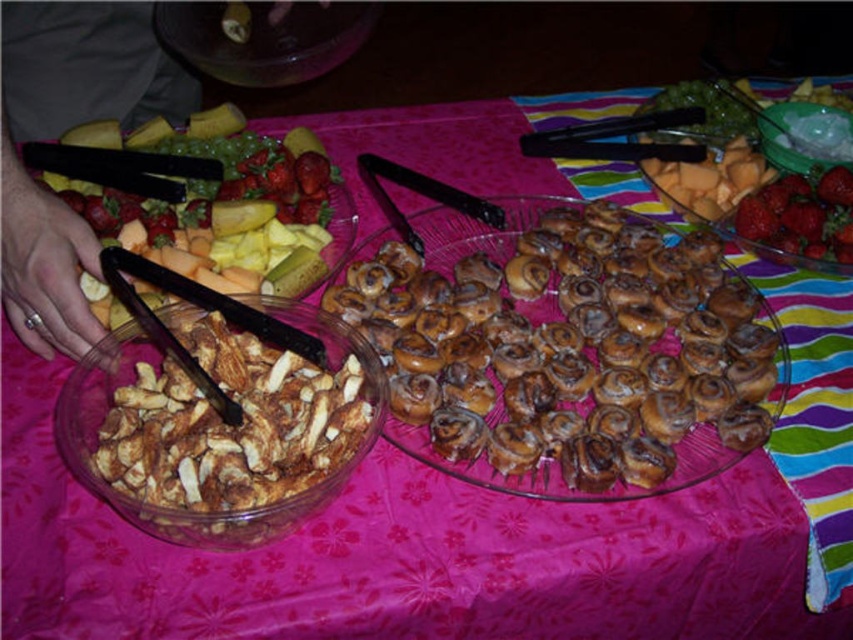
Question: Which of the following is the farthest from the observer?

Choices:
 (A) golden brown glazed pastry at center
 (B) red glossy strawberries at upper right

Answer: (B)

Question: Which point is farther to the camera?

Choices:
 (A) golden brown glazed pastry at center
 (B) red glossy strawberries at upper right

Answer: (B)

Question: Does brown crumbly bread at lower left have a greater width compared to red glossy strawberries at upper right?

Choices:
 (A) yes
 (B) no

Answer: (A)

Question: Where is brown crumbly bread at lower left located in relation to red glossy strawberries at upper right in the image?

Choices:
 (A) above
 (B) below

Answer: (B)

Question: Is golden brown glazed pastry at center positioned before red glossy strawberries at upper right?

Choices:
 (A) yes
 (B) no

Answer: (A)

Question: Among these points, which one is farthest from the camera?

Choices:
 (A) (207, 486)
 (B) (590, 362)
 (C) (833, 243)

Answer: (C)